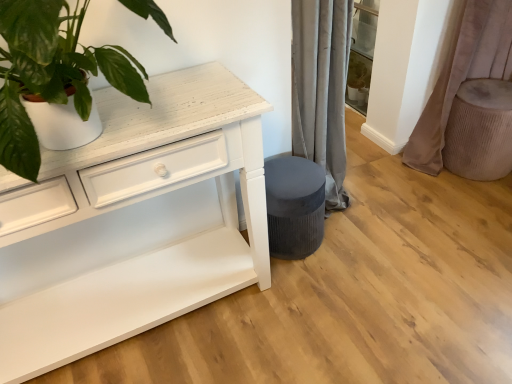
What are the coordinates of `white matte plant pot at upper left` in the screenshot? It's located at (51, 72).

Describe the element at coordinates (480, 130) in the screenshot. This screenshot has width=512, height=384. I see `beige textured ottoman at right` at that location.

What do you see at coordinates (294, 206) in the screenshot? This screenshot has width=512, height=384. I see `velvet dark gray stool at lower center` at bounding box center [294, 206].

The image size is (512, 384). Identify the location of velvet beige curtain at right. (462, 76).

Could you tell me if white matte plant pot at upper left is turned towards velvet dark gray stool at lower center?

No, white matte plant pot at upper left is not turned towards velvet dark gray stool at lower center.

Which of these two, white matte plant pot at upper left or velvet dark gray stool at lower center, stands taller?

white matte plant pot at upper left is taller.

Does point (25, 116) come closer to viewer compared to point (269, 223)?

Yes, it is.

Between velvet beige curtain at right and velvet dark gray stool at lower center, which one appears on the left side from the viewer's perspective?

Positioned to the left is velvet dark gray stool at lower center.

Is velvet beige curtain at right not within velvet dark gray stool at lower center?

Yes, velvet beige curtain at right is not within velvet dark gray stool at lower center.

Is point (420, 165) more distant than point (281, 227)?

Yes, it is behind point (281, 227).

Does velvet beige curtain at right have a smaller size compared to velvet dark gray stool at lower center?

Actually, velvet beige curtain at right might be larger than velvet dark gray stool at lower center.

Is beige textured ottoman at right positioned with its back to velvet beige curtain at right?

Result: Absolutely, beige textured ottoman at right is directed away from velvet beige curtain at right.

Considering the relative sizes of beige textured ottoman at right and velvet beige curtain at right in the image provided, is beige textured ottoman at right smaller than velvet beige curtain at right?

Yes.

Consider the image. Does beige textured ottoman at right come behind velvet beige curtain at right?

That is True.

Is beige textured ottoman at right not within velvet beige curtain at right?

No, beige textured ottoman at right is not entirely external to velvet beige curtain at right.

Which is closer, (472,168) or (298,209)?

Clearly, point (472,168) is more distant from the camera than point (298,209).

Looking at this image, relative to velvet dark gray stool at lower center, is beige textured ottoman at right in front or behind?

beige textured ottoman at right is behind velvet dark gray stool at lower center.

Considering the relative positions of beige textured ottoman at right and velvet dark gray stool at lower center in the image provided, is beige textured ottoman at right to the left of velvet dark gray stool at lower center from the viewer's perspective?

No, beige textured ottoman at right is not to the left of velvet dark gray stool at lower center.

Is velvet dark gray stool at lower center not inside white matte plant pot at upper left?

Absolutely, velvet dark gray stool at lower center is external to white matte plant pot at upper left.

From the image's perspective, between velvet dark gray stool at lower center and white matte plant pot at upper left, who is located below?

velvet dark gray stool at lower center.

From a real-world perspective, is velvet dark gray stool at lower center under white matte plant pot at upper left?

Yes, from a real-world perspective, velvet dark gray stool at lower center is below white matte plant pot at upper left.

Which of these two, velvet dark gray stool at lower center or white matte plant pot at upper left, is thinner?

velvet dark gray stool at lower center.

Who is smaller, white matte plant pot at upper left or beige textured ottoman at right?

beige textured ottoman at right is smaller.

Between point (76, 60) and point (464, 125), which one is positioned behind?

The point (464, 125) is behind.

Considering the relative positions of white matte plant pot at upper left and beige textured ottoman at right in the image provided, is white matte plant pot at upper left to the left or to the right of beige textured ottoman at right?

From the image, it's evident that white matte plant pot at upper left is to the left of beige textured ottoman at right.

In terms of size, does velvet beige curtain at right appear bigger or smaller than white matte plant pot at upper left?

velvet beige curtain at right is bigger than white matte plant pot at upper left.

Would you consider velvet beige curtain at right to be distant from white matte plant pot at upper left?

Yes, velvet beige curtain at right and white matte plant pot at upper left are quite far apart.

Measure the distance from velvet beige curtain at right to white matte plant pot at upper left.

6.19 feet.

Is velvet beige curtain at right aimed at white matte plant pot at upper left?

No, velvet beige curtain at right is not aimed at white matte plant pot at upper left.

You are a GUI agent. You are given a task and a screenshot of the screen. Output one action in this format:
    pyautogui.click(x=<x>, y=<y>)
    Task: Click on the music stool on the right of the white matte plant pot at upper left
    
    Given the screenshot: What is the action you would take?
    pyautogui.click(x=294, y=206)

Where is `curtain above the velvet dark gray stool at lower center (from a real-world perspective)`? This screenshot has width=512, height=384. curtain above the velvet dark gray stool at lower center (from a real-world perspective) is located at coordinates (462, 76).

When comparing their distances from velvet dark gray stool at lower center, does white matte plant pot at upper left or beige textured ottoman at right seem closer?

white matte plant pot at upper left is closer to velvet dark gray stool at lower center.

From the image, which object appears to be nearer to velvet beige curtain at right, beige textured ottoman at right or white matte plant pot at upper left?

beige textured ottoman at right.

Estimate the real-world distances between objects in this image. Which object is closer to beige textured ottoman at right, velvet dark gray stool at lower center or white matte plant pot at upper left?

The object closer to beige textured ottoman at right is velvet dark gray stool at lower center.

Looking at the image, which one is located further to beige textured ottoman at right, velvet beige curtain at right or white matte plant pot at upper left?

The object further to beige textured ottoman at right is white matte plant pot at upper left.

Estimate the real-world distances between objects in this image. Which object is closer to white matte plant pot at upper left, beige textured ottoman at right or velvet beige curtain at right?

Based on the image, beige textured ottoman at right appears to be nearer to white matte plant pot at upper left.

Looking at the image, which one is located further to white matte plant pot at upper left, velvet beige curtain at right or beige textured ottoman at right?

Among the two, velvet beige curtain at right is located further to white matte plant pot at upper left.

From the picture: Which object lies nearer to the anchor point white matte plant pot at upper left, velvet dark gray stool at lower center or velvet beige curtain at right?

velvet dark gray stool at lower center lies closer to white matte plant pot at upper left than the other object.

From the image, which object appears to be nearer to velvet dark gray stool at lower center, white matte plant pot at upper left or velvet beige curtain at right?

Among the two, white matte plant pot at upper left is located nearer to velvet dark gray stool at lower center.

Where is `curtain between white matte plant pot at upper left and beige textured ottoman at right`? The width and height of the screenshot is (512, 384). curtain between white matte plant pot at upper left and beige textured ottoman at right is located at coordinates (462, 76).

Find the location of a particular element. The width and height of the screenshot is (512, 384). music stool located between white matte plant pot at upper left and beige textured ottoman at right in the left-right direction is located at coordinates (294, 206).

This screenshot has width=512, height=384. What are the coordinates of `curtain between velvet dark gray stool at lower center and beige textured ottoman at right in the horizontal direction` in the screenshot? It's located at (462, 76).

Identify the location of music stool situated between white matte plant pot at upper left and velvet beige curtain at right from left to right. (294, 206).